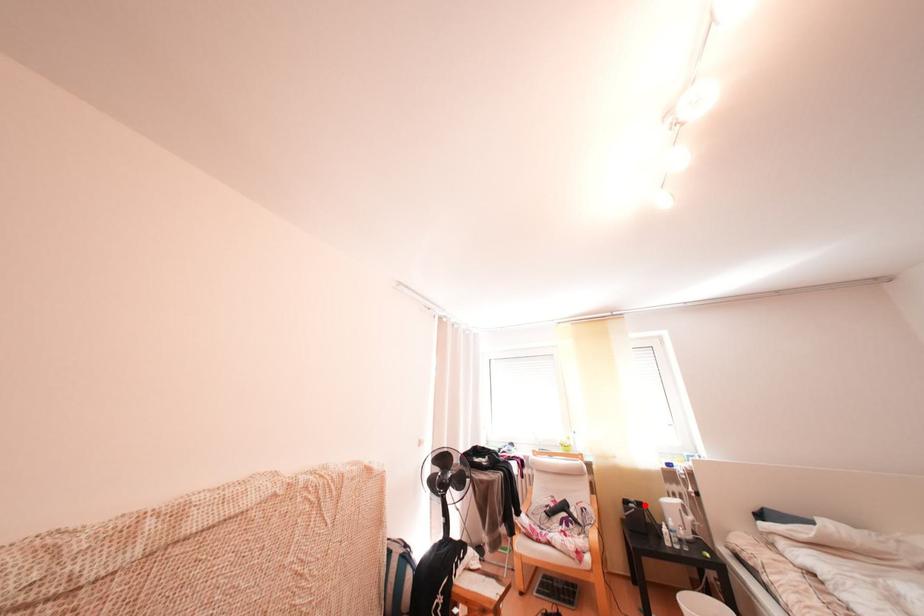
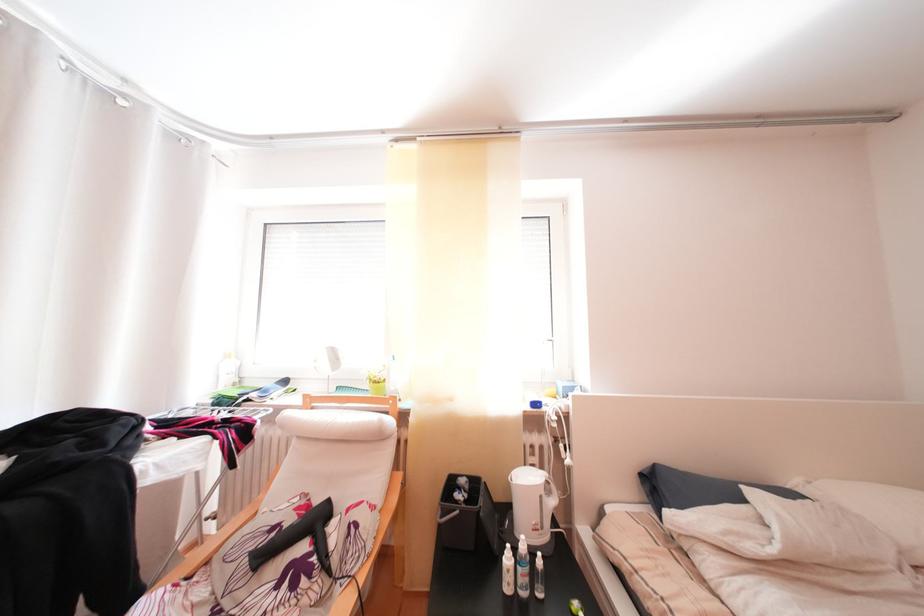
The point at the highlighted location is marked in the first image. Where is the corresponding point in the second image?

(475, 487)